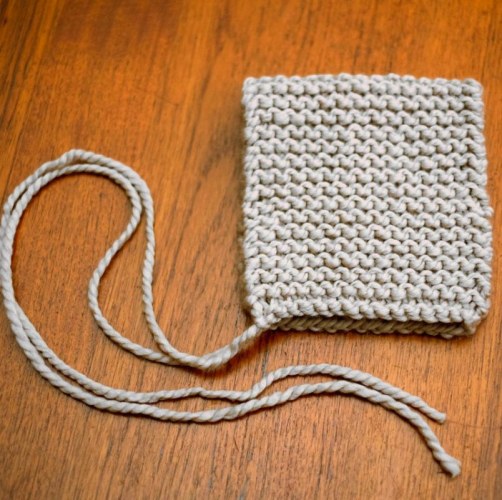
At what (x,y) coordinates should I click in order to perform the action: click on wood floor above handbag, at top of image. Please return your answer as a coordinate pair (x, y). Image resolution: width=502 pixels, height=500 pixels. Looking at the image, I should click on (335, 42), (419, 34).